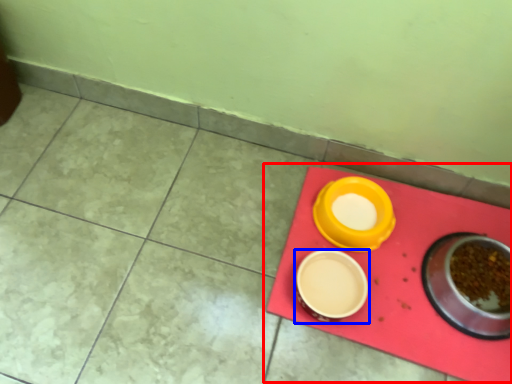
Question: Which of the following is the farthest to the observer, table (highlighted by a red box) or tableware (highlighted by a blue box)?

Choices:
 (A) table
 (B) tableware

Answer: (B)